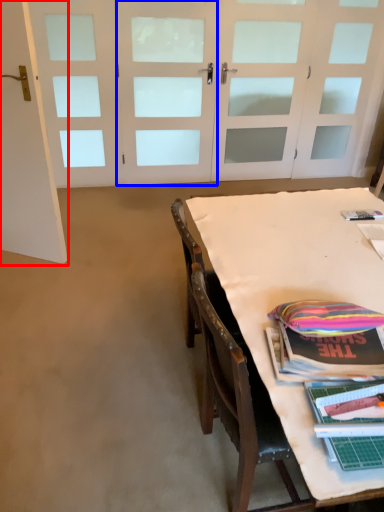
Question: Which object is further to the camera taking this photo, door (highlighted by a red box) or door (highlighted by a blue box)?

Choices:
 (A) door
 (B) door

Answer: (B)